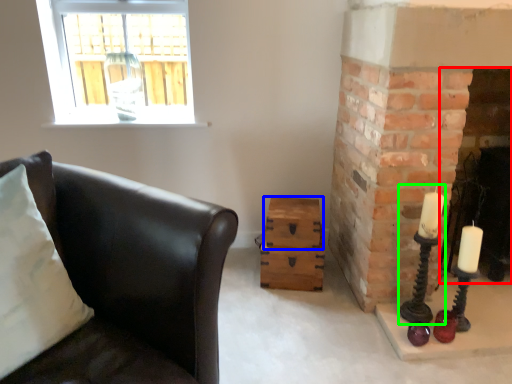
Question: Which is nearer to the fireplace (highlighted by a red box)? drawer (highlighted by a blue box) or candle holder (highlighted by a green box).

Choices:
 (A) drawer
 (B) candle holder

Answer: (B)